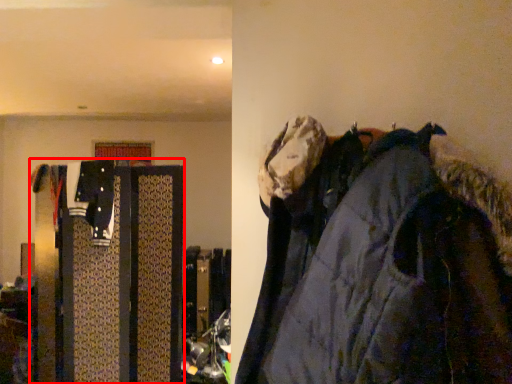
Question: From the image's perspective, where is closet (annotated by the red box) located in relation to jacket in the image?

Choices:
 (A) below
 (B) above

Answer: (A)